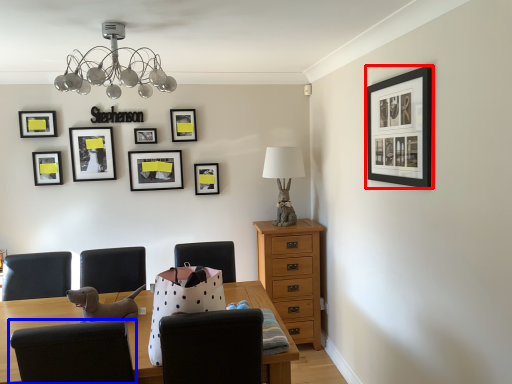
Question: Which object is closer to the camera taking this photo, picture frame (highlighted by a red box) or chair (highlighted by a blue box)?

Choices:
 (A) picture frame
 (B) chair

Answer: (B)